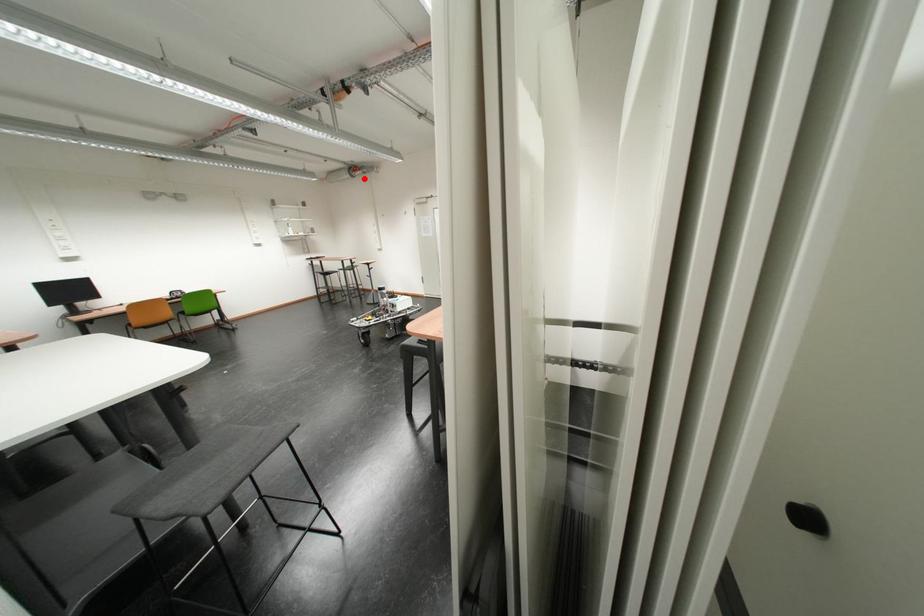
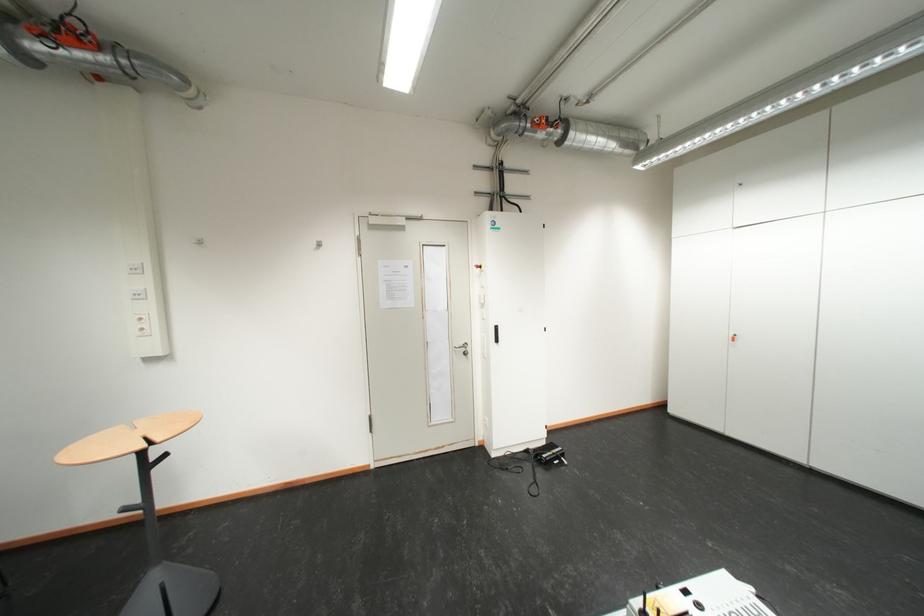
In the second image, find the point that corresponds to the highlighted location in the first image.

(35, 60)